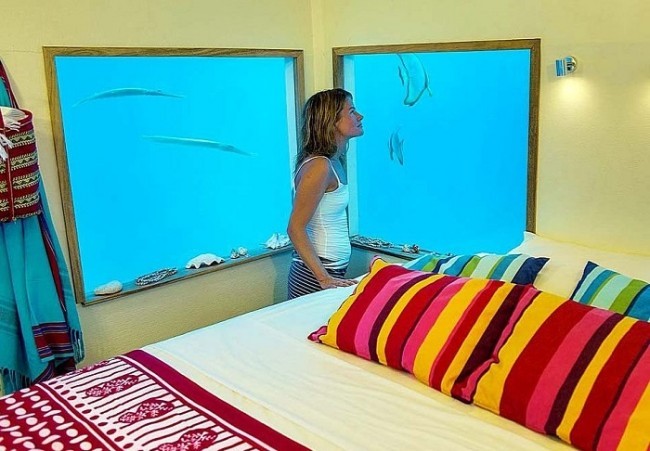
Find the location of `pillows`. pillows is located at coordinates (590, 329), (604, 296), (564, 254), (495, 265), (476, 304).